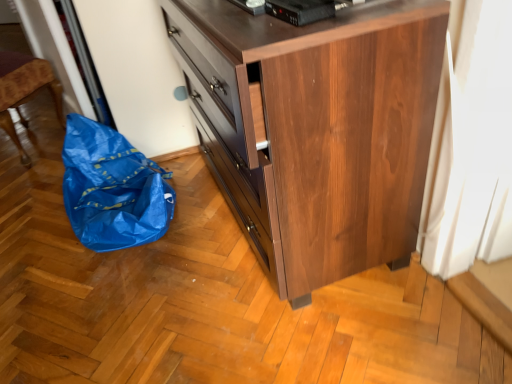
Question: Considering the relative sizes of blue plastic bag at left and black plastic device at upper center in the image provided, is blue plastic bag at left shorter than black plastic device at upper center?

Choices:
 (A) no
 (B) yes

Answer: (A)

Question: From a real-world perspective, is blue plastic bag at left physically above black plastic device at upper center?

Choices:
 (A) yes
 (B) no

Answer: (B)

Question: Is blue plastic bag at left further to the viewer compared to black plastic device at upper center?

Choices:
 (A) no
 (B) yes

Answer: (B)

Question: Does blue plastic bag at left turn towards black plastic device at upper center?

Choices:
 (A) no
 (B) yes

Answer: (A)

Question: Is blue plastic bag at left located outside black plastic device at upper center?

Choices:
 (A) yes
 (B) no

Answer: (A)

Question: Is point (275, 13) closer or farther from the camera than point (328, 127)?

Choices:
 (A) closer
 (B) farther

Answer: (A)

Question: Considering the positions of black plastic device at upper center and brown wood chest of drawers at center in the image, is black plastic device at upper center taller or shorter than brown wood chest of drawers at center?

Choices:
 (A) tall
 (B) short

Answer: (B)

Question: Is black plastic device at upper center in front of or behind brown wood chest of drawers at center in the image?

Choices:
 (A) front
 (B) behind

Answer: (B)

Question: From the image's perspective, is black plastic device at upper center located above or below brown wood chest of drawers at center?

Choices:
 (A) below
 (B) above

Answer: (B)

Question: Looking at their shapes, would you say brown wood chest of drawers at center is wider or thinner than black plastic device at upper center?

Choices:
 (A) wide
 (B) thin

Answer: (A)

Question: In terms of height, does brown wood chest of drawers at center look taller or shorter compared to black plastic device at upper center?

Choices:
 (A) tall
 (B) short

Answer: (A)

Question: Based on their sizes in the image, would you say brown wood chest of drawers at center is bigger or smaller than black plastic device at upper center?

Choices:
 (A) small
 (B) big

Answer: (B)

Question: From the image's perspective, is brown wood chest of drawers at center positioned above or below black plastic device at upper center?

Choices:
 (A) below
 (B) above

Answer: (A)

Question: In terms of height, does blue plastic bag at left look taller or shorter compared to brown wood chest of drawers at center?

Choices:
 (A) tall
 (B) short

Answer: (B)

Question: In the image, is blue plastic bag at left on the left side or the right side of brown wood chest of drawers at center?

Choices:
 (A) right
 (B) left

Answer: (B)